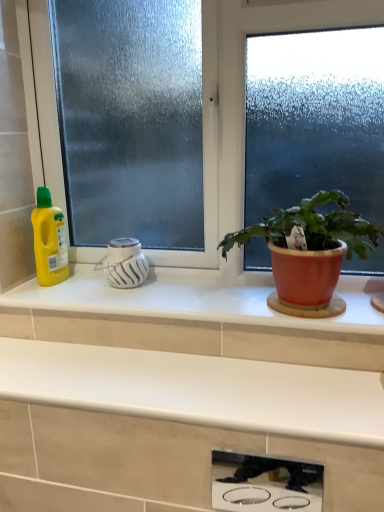
Where is `vacant space in front of white matte diffuser at center, which is the 1th appliance from back to front`? The width and height of the screenshot is (384, 512). vacant space in front of white matte diffuser at center, which is the 1th appliance from back to front is located at coordinates (123, 300).